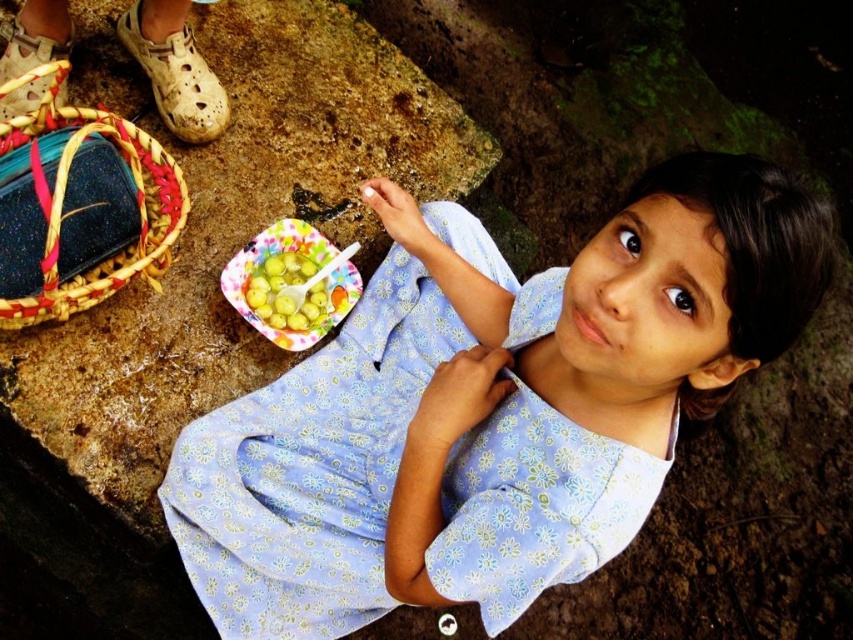
Question: Which point appears farthest from the camera in this image?

Choices:
 (A) (299, 244)
 (B) (219, 422)
 (C) (281, 317)

Answer: (A)

Question: Among these points, which one is nearest to the camera?

Choices:
 (A) (285, 310)
 (B) (132, 264)
 (C) (206, 550)
 (D) (347, 273)

Answer: (B)

Question: Which point is closer to the camera taking this photo?

Choices:
 (A) (300, 301)
 (B) (461, 525)

Answer: (B)

Question: Is blue floral fabric dress at center positioned before woven straw basket at lower left?

Choices:
 (A) yes
 (B) no

Answer: (A)

Question: Is blue floral fabric dress at center to the right of woven straw basket at lower left from the viewer's perspective?

Choices:
 (A) no
 (B) yes

Answer: (B)

Question: Observing the image, what is the correct spatial positioning of woven straw basket at lower left in reference to green matte fruit at center?

Choices:
 (A) above
 (B) below

Answer: (A)